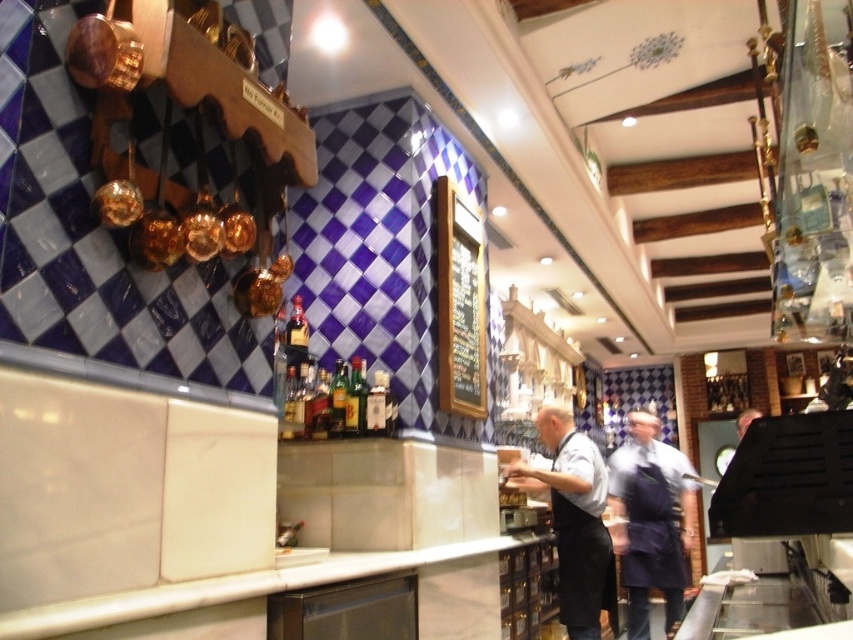
Question: Which of these objects is positioned farthest from the dark blue apron at center?

Choices:
 (A) black apron at center
 (B) white marble counter at center

Answer: (B)

Question: Based on their relative distances, which object is farther from the black apron at center?

Choices:
 (A) white marble counter at center
 (B) dark blue apron at center

Answer: (B)

Question: Which point is farther to the camera?

Choices:
 (A) dark blue apron at center
 (B) white marble counter at center

Answer: (A)

Question: Where is white marble counter at center located in relation to black apron at center in the image?

Choices:
 (A) above
 (B) below

Answer: (A)

Question: Can you confirm if dark blue apron at center is bigger than white marble counter at center?

Choices:
 (A) no
 (B) yes

Answer: (A)

Question: Where is dark blue apron at center located in relation to white marble counter at center in the image?

Choices:
 (A) above
 (B) below

Answer: (B)